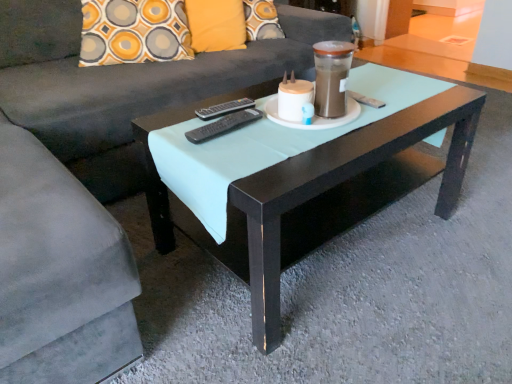
This screenshot has height=384, width=512. I want to click on empty space that is ontop of black matte coffee table at center (from a real-world perspective), so click(x=305, y=123).